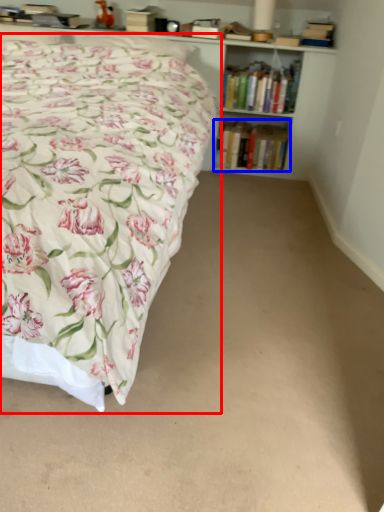
Question: Among these objects, which one is farthest to the camera, bed (highlighted by a red box) or book (highlighted by a blue box)?

Choices:
 (A) bed
 (B) book

Answer: (B)